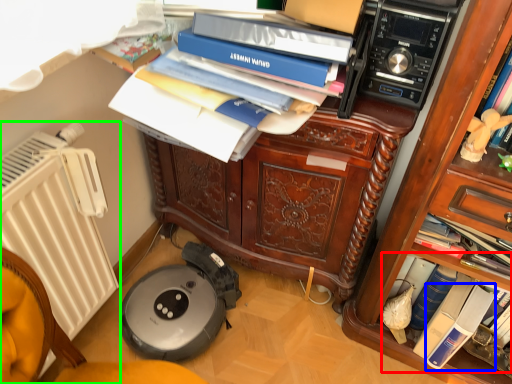
Question: Based on their relative distances, which object is nearer to book (highlighted by a red box)? Choose from paperback book (highlighted by a blue box) and radiator (highlighted by a green box).

Choices:
 (A) paperback book
 (B) radiator

Answer: (A)